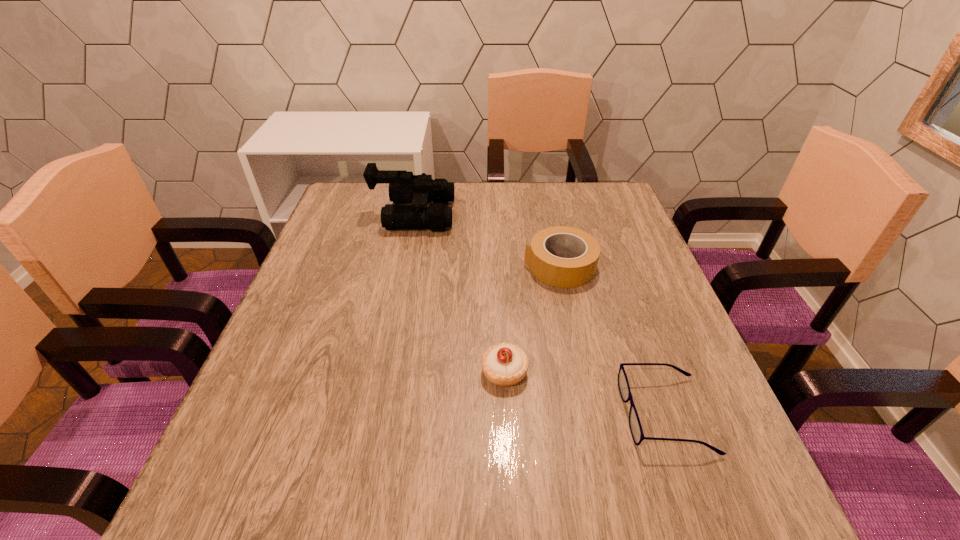
I want to click on vacant region located on the front-facing side of the spectacles, so click(586, 414).

At what (x,y) coordinates should I click in order to perform the action: click on vacant point located on the front-facing side of the spectacles. Please return your answer as a coordinate pair (x, y). This screenshot has width=960, height=540. Looking at the image, I should click on click(x=474, y=414).

Locate an element on the screen. vacant space located 0.060m on the front-facing side of the spectacles is located at coordinates (591, 414).

Where is `object located at the far edge`? This screenshot has height=540, width=960. object located at the far edge is located at coordinates (404, 187).

You are a GUI agent. You are given a task and a screenshot of the screen. Output one action in this format:
    pyautogui.click(x=<x>, y=<y>)
    Task: Click on the object located at the left edge
    The height and width of the screenshot is (540, 960).
    Given the screenshot: What is the action you would take?
    pyautogui.click(x=404, y=187)

This screenshot has width=960, height=540. I want to click on duct tape at the right edge, so click(560, 272).

This screenshot has height=540, width=960. I want to click on spectacles present at the right edge, so click(x=635, y=426).

Locate an element on the screen. This screenshot has width=960, height=540. object that is at the far left corner is located at coordinates (404, 187).

Where is `free space at the far edge of the desktop`? Image resolution: width=960 pixels, height=540 pixels. free space at the far edge of the desktop is located at coordinates (549, 213).

In order to click on vacant position at the near edge of the desktop in this screenshot , I will do `click(580, 505)`.